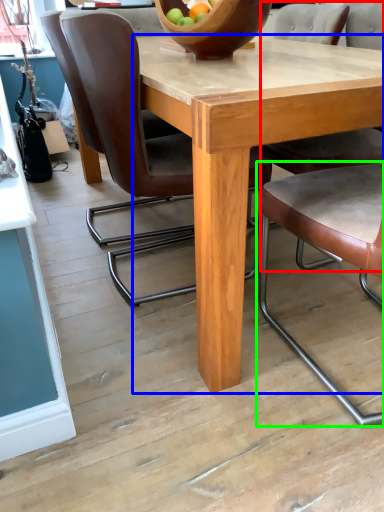
Question: Estimate the real-world distances between objects in this image. Which object is farther from chair (highlighted by a red box), round table (highlighted by a blue box) or chair (highlighted by a green box)?

Choices:
 (A) round table
 (B) chair

Answer: (B)